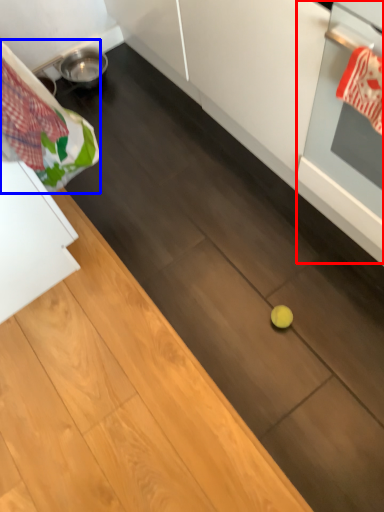
Question: Among these objects, which one is nearest to the camera, oven (highlighted by a red box) or laundry (highlighted by a blue box)?

Choices:
 (A) oven
 (B) laundry

Answer: (A)